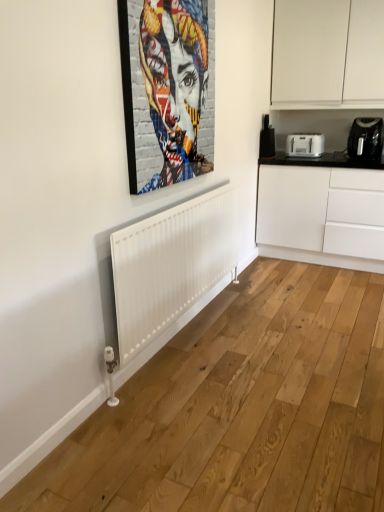
Question: Would you say metallic silver picture frame at upper center contains white matte cabinet at right, marked as the second cabinetry in a top-to-bottom arrangement?

Choices:
 (A) no
 (B) yes

Answer: (A)

Question: Does metallic silver picture frame at upper center have a larger size compared to white matte cabinet at right, the first cabinetry ordered from the bottom?

Choices:
 (A) no
 (B) yes

Answer: (A)

Question: Does metallic silver picture frame at upper center have a lesser width compared to white matte cabinet at right, marked as the second cabinetry in a top-to-bottom arrangement?

Choices:
 (A) yes
 (B) no

Answer: (A)

Question: Considering the relative positions of metallic silver picture frame at upper center and white matte cabinet at right, marked as the second cabinetry in a top-to-bottom arrangement, in the image provided, is metallic silver picture frame at upper center in front of white matte cabinet at right, marked as the second cabinetry in a top-to-bottom arrangement,?

Choices:
 (A) no
 (B) yes

Answer: (B)

Question: From a real-world perspective, is metallic silver picture frame at upper center under white matte cabinet at right, the first cabinetry ordered from the bottom?

Choices:
 (A) no
 (B) yes

Answer: (A)

Question: Is metallic silver picture frame at upper center bigger or smaller than white matte cabinet at upper right, placed as the second cabinetry when sorted from bottom to top?

Choices:
 (A) small
 (B) big

Answer: (A)

Question: Based on their positions, is metallic silver picture frame at upper center located to the left or right of white matte cabinet at upper right, the 1th cabinetry from the top?

Choices:
 (A) left
 (B) right

Answer: (A)

Question: In the image, is metallic silver picture frame at upper center positioned in front of or behind white matte cabinet at upper right, the 1th cabinetry from the top?

Choices:
 (A) front
 (B) behind

Answer: (A)

Question: Considering the positions of metallic silver picture frame at upper center and white matte cabinet at upper right, placed as the second cabinetry when sorted from bottom to top, in the image, is metallic silver picture frame at upper center wider or thinner than white matte cabinet at upper right, placed as the second cabinetry when sorted from bottom to top,?

Choices:
 (A) thin
 (B) wide

Answer: (A)

Question: Considering the positions of white plastic toaster at upper right and black plastic toaster at upper right, placed as the 2th appliance when sorted from left to right, in the image, is white plastic toaster at upper right bigger or smaller than black plastic toaster at upper right, placed as the 2th appliance when sorted from left to right,?

Choices:
 (A) big
 (B) small

Answer: (B)

Question: Considering their positions, is white plastic toaster at upper right located in front of or behind black plastic toaster at upper right, which appears as the 1th appliance when viewed from the right?

Choices:
 (A) front
 (B) behind

Answer: (B)

Question: From the image's perspective, is white plastic toaster at upper right located above or below black plastic toaster at upper right, which appears as the 1th appliance when viewed from the right?

Choices:
 (A) above
 (B) below

Answer: (A)

Question: Does point (306, 143) appear closer or farther from the camera than point (379, 121)?

Choices:
 (A) closer
 (B) farther

Answer: (B)

Question: From a real-world perspective, is metallic silver picture frame at upper center physically located above or below white plastic toaster at upper right?

Choices:
 (A) above
 (B) below

Answer: (A)

Question: Considering the positions of point (165, 88) and point (316, 154), is point (165, 88) closer or farther from the camera than point (316, 154)?

Choices:
 (A) closer
 (B) farther

Answer: (A)